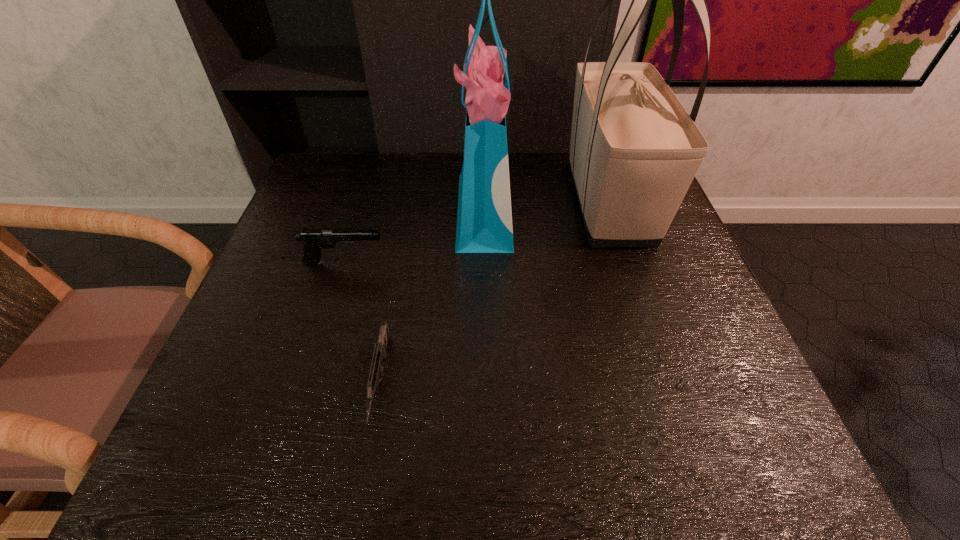
Find the location of a particular element. The image size is (960, 540). empty space between the second nearest object and the shortest object is located at coordinates (362, 322).

I want to click on vacant region between the shortest object and the third object from left to right, so click(x=432, y=297).

Locate an element on the screen. vacant space in between the left shopping bag and the rightmost object is located at coordinates (546, 207).

This screenshot has height=540, width=960. I want to click on blank region between the left shopping bag and the shortest object, so click(x=432, y=297).

At what (x,y) coordinates should I click in order to perform the action: click on free space between the second nearest object and the second object from left to right. Please return your answer as a coordinate pair (x, y). Looking at the image, I should click on (362, 322).

Find the location of a particular element. The width and height of the screenshot is (960, 540). empty space between the farther gun and the nearest object is located at coordinates (362, 322).

Identify the location of empty location between the rightmost object and the left shopping bag. (546, 207).

In order to click on object that is the third closest to the farther gun in this screenshot , I will do `click(634, 151)`.

Choose which object is the nearest neighbor to the shortest object. Please provide its 2D coordinates. Your answer should be formatted as a tuple, i.e. [(x, y)], where the tuple contains the x and y coordinates of a point satisfying the conditions above.

[(314, 240)]

The width and height of the screenshot is (960, 540). Identify the location of vacant space that satisfies the following two spatial constraints: 1. with handles facing forward on the rightmost object; 2. at the aiming end of the left gun. (629, 262).